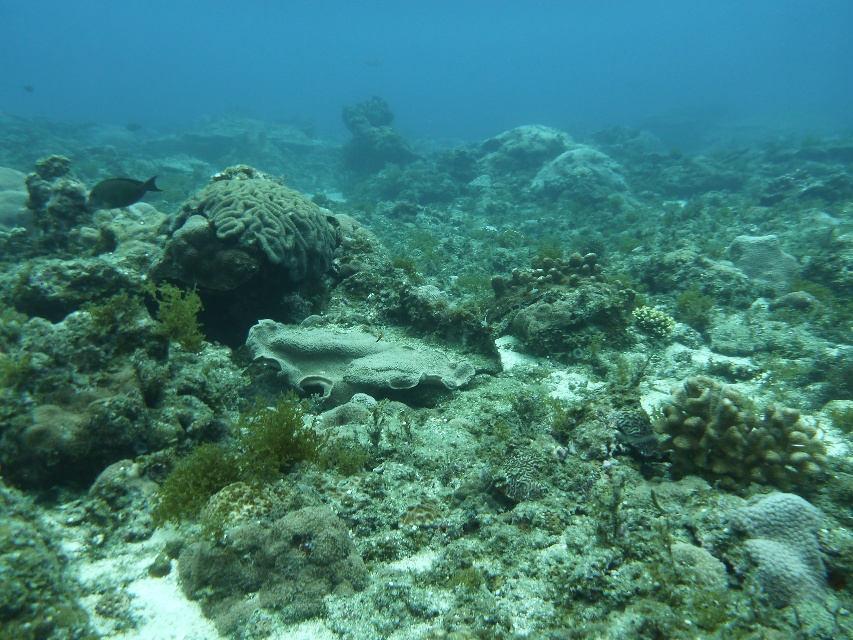
Question: Which of the following is the farthest from the observer?

Choices:
 (A) green textured coral at center
 (B) shiny blue fish at left

Answer: (B)

Question: Which of the following is the closest to the observer?

Choices:
 (A) (241, 474)
 (B) (163, 259)

Answer: (A)

Question: Which point appears farthest from the camera in this image?

Choices:
 (A) (804, 426)
 (B) (212, 234)

Answer: (B)

Question: Is green matte algae at center wider than shiny blue fish at left?

Choices:
 (A) yes
 (B) no

Answer: (A)

Question: Is gray porous coral at center below shiny blue fish at left?

Choices:
 (A) no
 (B) yes

Answer: (B)

Question: Where is brown coral at lower right located in relation to gray porous coral at center in the image?

Choices:
 (A) below
 (B) above

Answer: (A)